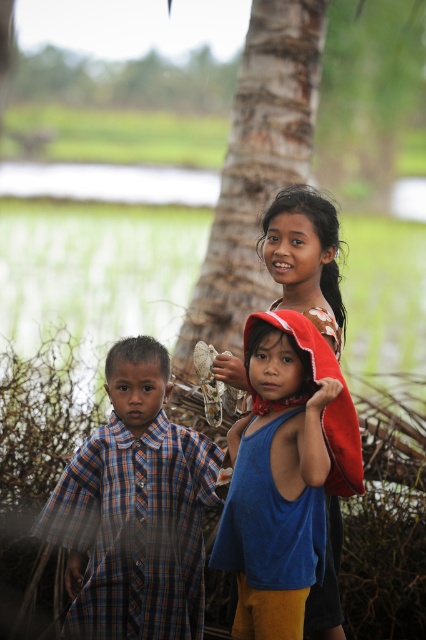
Question: Which of the following is the farthest from the observer?

Choices:
 (A) brown rough tree trunk at center
 (B) plaid fabric shirt at left
 (C) blue fabric at center

Answer: (A)

Question: Based on their relative distances, which object is farther from the blue fabric at center?

Choices:
 (A) plaid fabric shirt at left
 (B) brown rough tree trunk at center

Answer: (B)

Question: Can you confirm if plaid fabric shirt at left is positioned above brown rough tree trunk at center?

Choices:
 (A) yes
 (B) no

Answer: (B)

Question: Does plaid fabric shirt at left appear over brown rough tree trunk at center?

Choices:
 (A) no
 (B) yes

Answer: (A)

Question: Can you confirm if brown rough tree trunk at center is positioned to the right of blue fabric at center?

Choices:
 (A) no
 (B) yes

Answer: (A)

Question: Among these points, which one is farthest from the camera?

Choices:
 (A) (314, 227)
 (B) (290, 148)

Answer: (B)